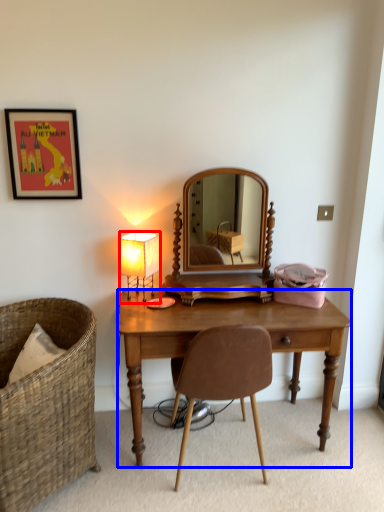
Question: Which of the following is the farthest to the observer, lamp (highlighted by a red box) or desk (highlighted by a blue box)?

Choices:
 (A) lamp
 (B) desk

Answer: (A)